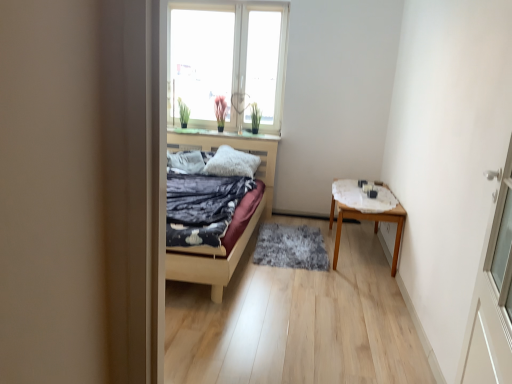
Question: Considering the relative positions of white fluffy pillow at center, arranged as the 1th pillow when viewed from the right, and white textured table at right in the image provided, is white fluffy pillow at center, arranged as the 1th pillow when viewed from the right, to the left or to the right of white textured table at right?

Choices:
 (A) left
 (B) right

Answer: (A)

Question: From the image's perspective, is white fluffy pillow at center, positioned as the 2th pillow in left-to-right order, located above or below white textured table at right?

Choices:
 (A) below
 (B) above

Answer: (B)

Question: Which object is positioned farthest from the transparent glass window at upper center?

Choices:
 (A) white fluffy pillow at center, positioned as the 2th pillow in left-to-right order
 (B) textured gray pillow at center, the 2th pillow viewed from the right
 (C) wooden table at right
 (D) white glossy window sill at upper center
 (E) gray shaggy rug at center

Answer: (C)

Question: Which of these objects is positioned closest to the white textured table at right?

Choices:
 (A) wooden table at right
 (B) white glossy window sill at upper center
 (C) gray shaggy rug at center
 (D) white fluffy pillow at center, arranged as the 1th pillow when viewed from the right
 (E) textured gray pillow at center, the 2th pillow viewed from the right

Answer: (A)